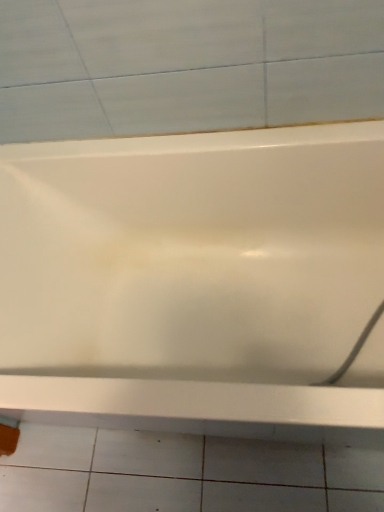
The width and height of the screenshot is (384, 512). What do you see at coordinates (183, 473) in the screenshot?
I see `white glossy ceramic tile at lower center` at bounding box center [183, 473].

What is the approximate height of white glossy ceramic tile at lower center?

0.51 inches.

I want to click on white glossy ceramic tile at lower center, so click(183, 473).

Measure the distance between white glossy ceramic tile at lower center and camera.

1.09 meters.

Where is `white glossy bathtub at center`? white glossy bathtub at center is located at coordinates (195, 281).

From the picture: In order to face white glossy bathtub at center, should I rotate leftwards or rightwards?

You should look right and rotate roughly 0.016 degrees.

What do you see at coordinates (195, 281) in the screenshot?
I see `white glossy bathtub at center` at bounding box center [195, 281].

Where is `white glossy ceramic tile at lower center`? The width and height of the screenshot is (384, 512). white glossy ceramic tile at lower center is located at coordinates (183, 473).

Between white glossy ceramic tile at lower center and white glossy bathtub at center, which one appears on the right side from the viewer's perspective?

white glossy bathtub at center is more to the right.

Which object is closer to the camera, white glossy ceramic tile at lower center or white glossy bathtub at center?

white glossy bathtub at center is more forward.

Is point (116, 500) in front of point (84, 176)?

No, it is behind (84, 176).

From the image's perspective, is white glossy ceramic tile at lower center beneath white glossy bathtub at center?

Yes, from the image's perspective, white glossy ceramic tile at lower center is beneath white glossy bathtub at center.

From a real-world perspective, between white glossy ceramic tile at lower center and white glossy bathtub at center, who is vertically higher?

white glossy bathtub at center is physically above.

Between white glossy ceramic tile at lower center and white glossy bathtub at center, which one has smaller width?

With smaller width is white glossy bathtub at center.

Can you confirm if white glossy ceramic tile at lower center is taller than white glossy bathtub at center?

No, white glossy ceramic tile at lower center is not taller than white glossy bathtub at center.

Can you confirm if white glossy ceramic tile at lower center is bigger than white glossy bathtub at center?

No, white glossy ceramic tile at lower center is not bigger than white glossy bathtub at center.

Is white glossy ceramic tile at lower center surrounding white glossy bathtub at center?

No, white glossy ceramic tile at lower center does not contain white glossy bathtub at center.

Can you see white glossy ceramic tile at lower center touching white glossy bathtub at center?

No, white glossy ceramic tile at lower center is not in contact with white glossy bathtub at center.

Could you tell me if white glossy ceramic tile at lower center is turned towards white glossy bathtub at center?

No, white glossy ceramic tile at lower center is not aimed at white glossy bathtub at center.

How many degrees apart are the facing directions of white glossy ceramic tile at lower center and white glossy bathtub at center?

The angular difference between white glossy ceramic tile at lower center and white glossy bathtub at center is 90 degrees.

Where is `bathtub on the right of white glossy ceramic tile at lower center`? The image size is (384, 512). bathtub on the right of white glossy ceramic tile at lower center is located at coordinates (195, 281).

Can you confirm if white glossy bathtub at center is positioned to the right of white glossy ceramic tile at lower center?

Yes.

Which is behind, white glossy bathtub at center or white glossy ceramic tile at lower center?

white glossy ceramic tile at lower center is further away from the camera.

Does point (106, 408) come closer to viewer compared to point (51, 484)?

That is True.

From the image's perspective, which is below, white glossy bathtub at center or white glossy ceramic tile at lower center?

white glossy ceramic tile at lower center is shown below in the image.

From a real-world perspective, which is physically above, white glossy bathtub at center or white glossy ceramic tile at lower center?

In real-world perspective, white glossy bathtub at center is above.

Is white glossy bathtub at center thinner than white glossy ceramic tile at lower center?

Yes, white glossy bathtub at center is thinner than white glossy ceramic tile at lower center.

Who is taller, white glossy bathtub at center or white glossy ceramic tile at lower center?

white glossy bathtub at center is taller.

Who is bigger, white glossy bathtub at center or white glossy ceramic tile at lower center?

With larger size is white glossy bathtub at center.

Would you say white glossy ceramic tile at lower center is part of white glossy bathtub at center's contents?

No, white glossy ceramic tile at lower center is located outside of white glossy bathtub at center.

Are white glossy bathtub at center and white glossy ceramic tile at lower center making contact?

No, white glossy bathtub at center is not with white glossy ceramic tile at lower center.

Is white glossy bathtub at center facing away from white glossy ceramic tile at lower center?

white glossy bathtub at center is not turned away from white glossy ceramic tile at lower center.

How distant is white glossy bathtub at center from white glossy ceramic tile at lower center?

17.89 inches.

In order to click on ceramic tile behind the white glossy bathtub at center in this screenshot , I will do click(x=183, y=473).

The height and width of the screenshot is (512, 384). What are the coordinates of `bathtub above the white glossy ceramic tile at lower center (from the image's perspective)` in the screenshot? It's located at (195, 281).

Image resolution: width=384 pixels, height=512 pixels. Find the location of `ceramic tile that appears below the white glossy bathtub at center (from the image's perspective)`. ceramic tile that appears below the white glossy bathtub at center (from the image's perspective) is located at coordinates (183, 473).